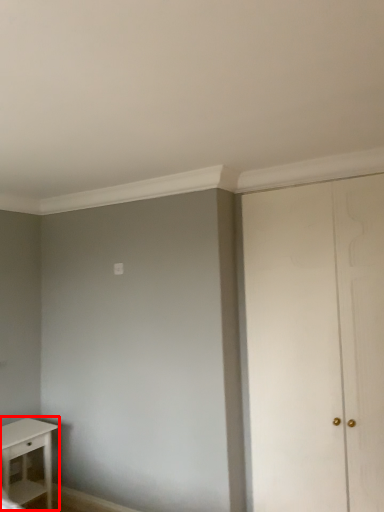
Question: In this image, where is table (annotated by the red box) located relative to door?

Choices:
 (A) right
 (B) left

Answer: (B)